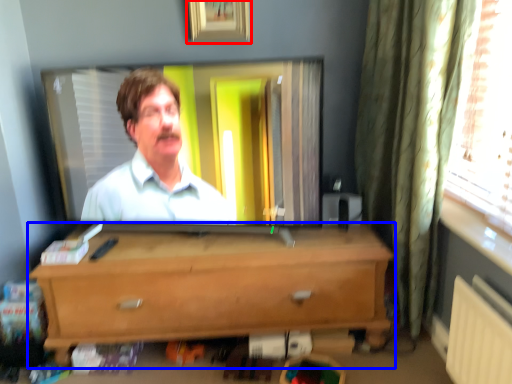
Question: Among these objects, which one is farthest to the camera, picture frame (highlighted by a red box) or chest of drawers (highlighted by a blue box)?

Choices:
 (A) picture frame
 (B) chest of drawers

Answer: (A)